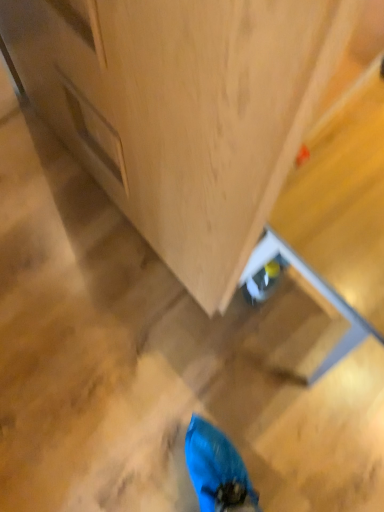
Describe the element at coordinates (182, 110) in the screenshot. I see `wooden cabinet at lower center` at that location.

What is the approximate width of wooden cabinet at lower center?

wooden cabinet at lower center is 2.90 inches in width.

I want to click on wooden cabinet at lower center, so click(x=182, y=110).

This screenshot has height=512, width=384. Find the location of `wooden cabinet at lower center`. wooden cabinet at lower center is located at coordinates (182, 110).